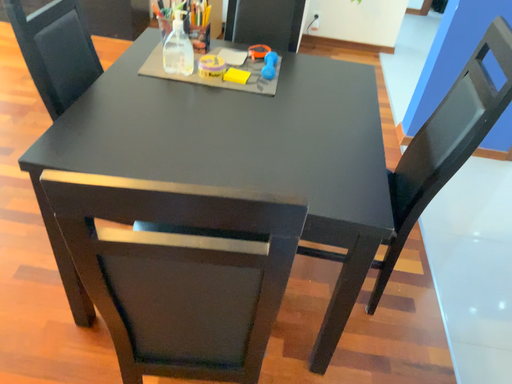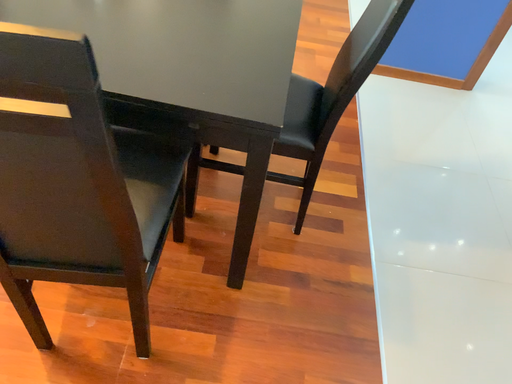
Question: How did the camera likely rotate when shooting the video?

Choices:
 (A) rotated downward
 (B) rotated upward

Answer: (A)